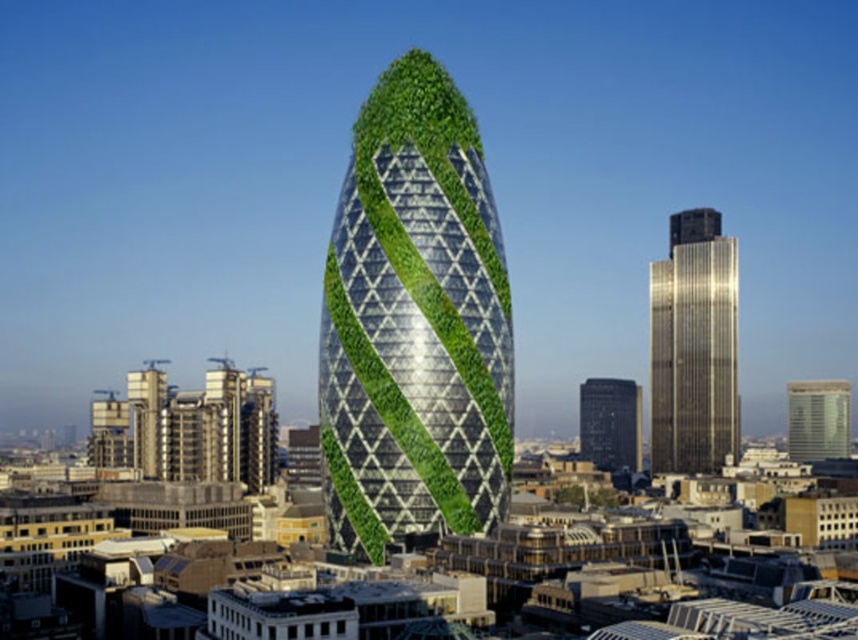
You are standing in the futuristic city and want to take a photo of the skyscraper. You notice two points in the scene labeled as point (458, 173) and point (714, 304). Which point is closer to your camera when taking the photo?

Point (458, 173) is closer to the camera than point (714, 304).

You are standing at a viewpoint overlooking the futuristic city. You notice two points marked on the horizon. The first point is at coordinates point [674,420] and the second is at point [599,397]. Which of these two points is closer to you?

Point [674,420] is in front of point [599,397], so it is closer to you.